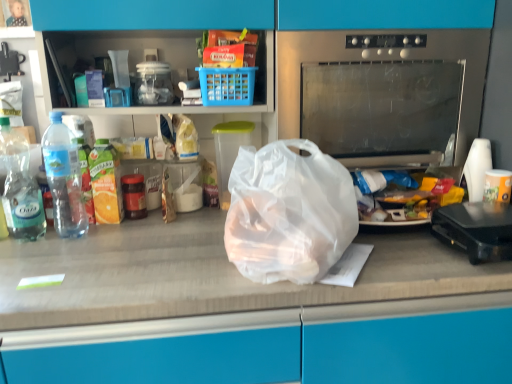
At what (x,y) coordinates should I click in order to perform the action: click on free space to the left of black plastic toaster at right. Please return your answer as a coordinate pair (x, y). The image size is (512, 384). Looking at the image, I should click on (400, 260).